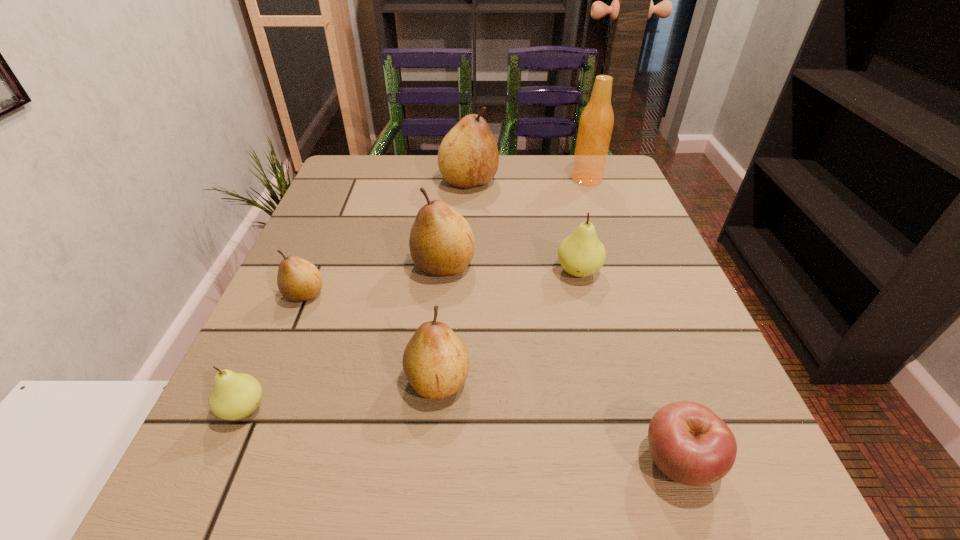
The width and height of the screenshot is (960, 540). I want to click on beer bottle that is at the far edge, so click(x=596, y=123).

At what (x,y) coordinates should I click in order to perform the action: click on pear at the far edge. Please return your answer as a coordinate pair (x, y). The image size is (960, 540). Looking at the image, I should click on (468, 156).

This screenshot has height=540, width=960. What are the coordinates of `object located at the near edge` in the screenshot? It's located at (689, 443).

What are the coordinates of `beer bottle that is at the right edge` in the screenshot? It's located at (596, 123).

At what (x,y) coordinates should I click in order to perform the action: click on pear that is at the right edge. Please return your answer as a coordinate pair (x, y). The height and width of the screenshot is (540, 960). Looking at the image, I should click on (581, 254).

Locate an element on the screen. The height and width of the screenshot is (540, 960). apple present at the right edge is located at coordinates (689, 443).

Find the location of a particular element. This screenshot has height=540, width=960. object that is at the far right corner is located at coordinates (596, 123).

The width and height of the screenshot is (960, 540). I want to click on object situated at the near right corner, so click(x=689, y=443).

In order to click on vacant space at the far edge of the desktop in this screenshot , I will do `click(531, 177)`.

Where is `vacant point at the near edge`? vacant point at the near edge is located at coordinates (589, 478).